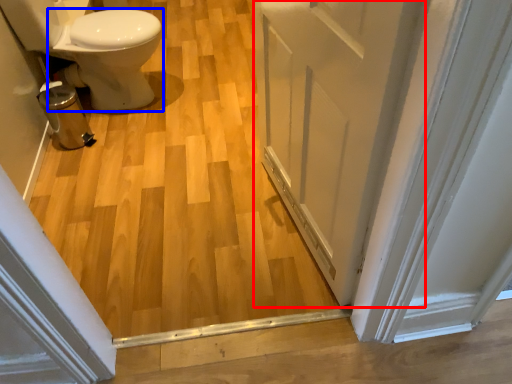
Question: Which object is further to the camera taking this photo, door (highlighted by a red box) or bidet (highlighted by a blue box)?

Choices:
 (A) door
 (B) bidet

Answer: (B)